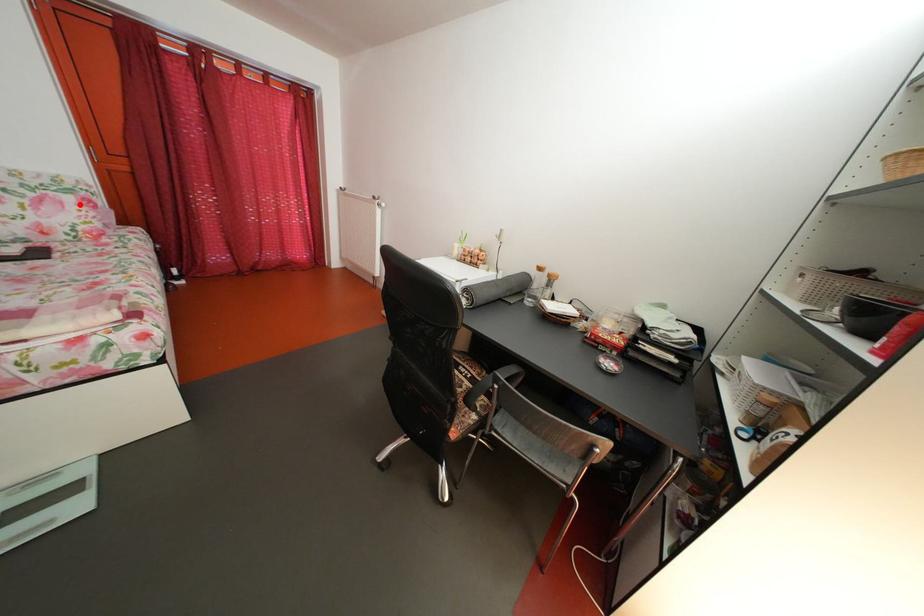
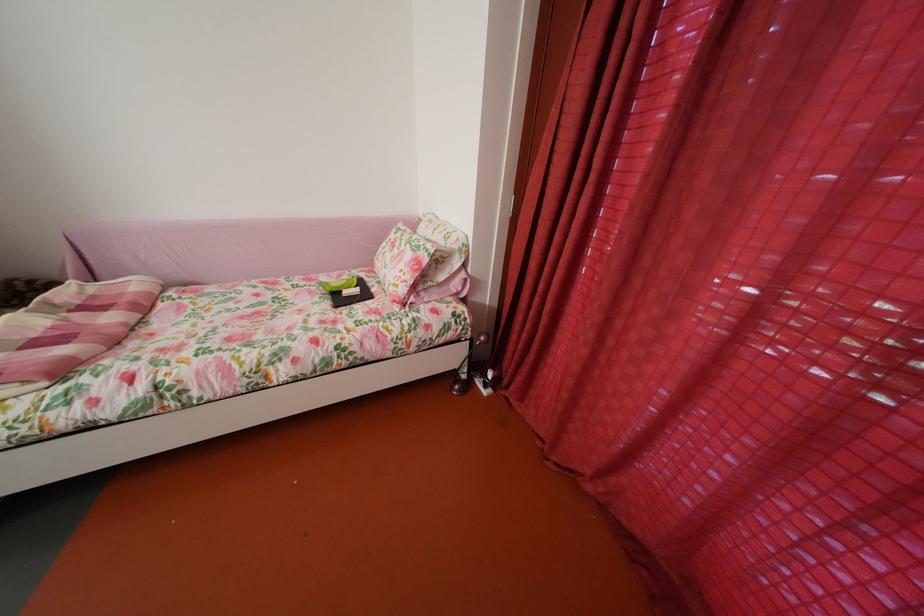
The point at the highlighted location is marked in the first image. Where is the corresponding point in the second image?

(419, 262)